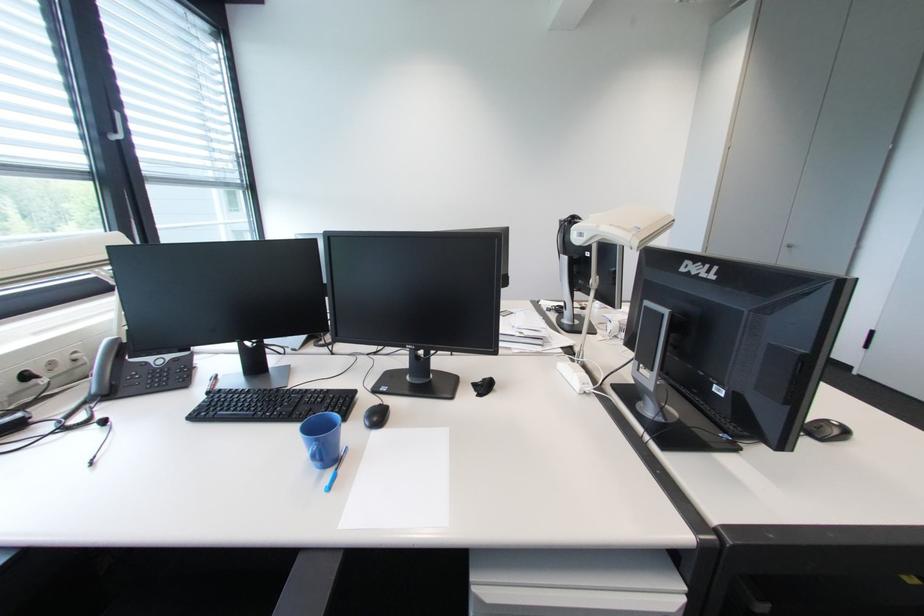
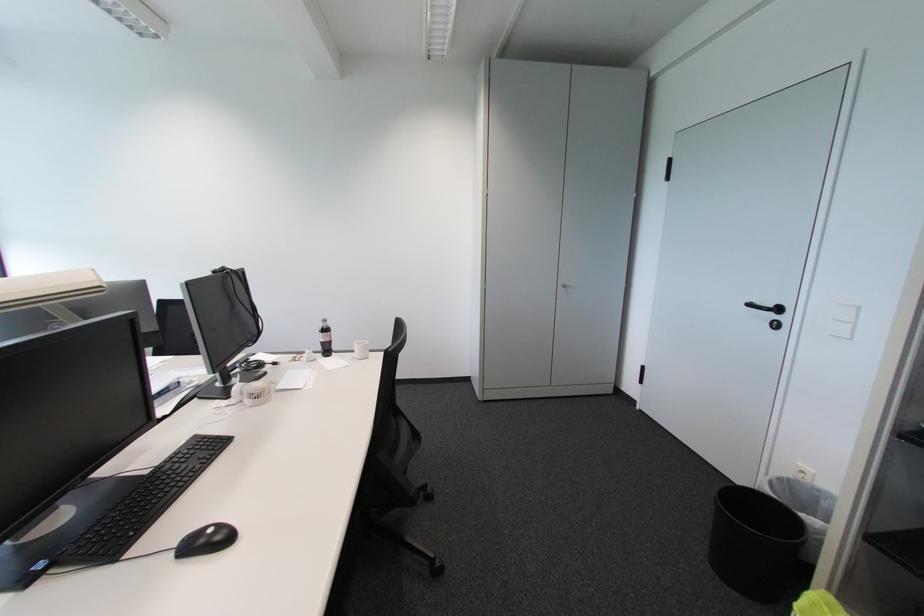
Where in the second image is the point corresponding to (792,249) from the first image?

(567, 290)